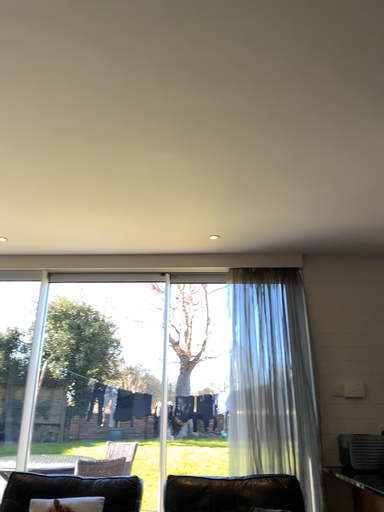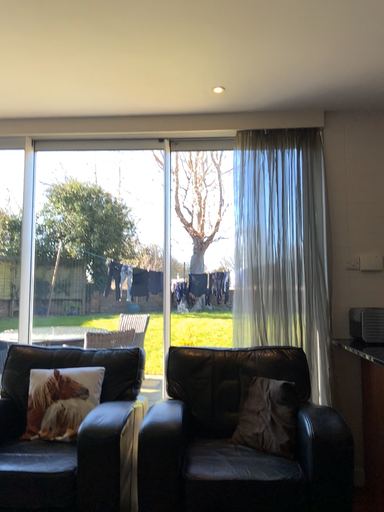
Question: Which way did the camera rotate in the video?

Choices:
 (A) rotated upward
 (B) rotated downward

Answer: (B)